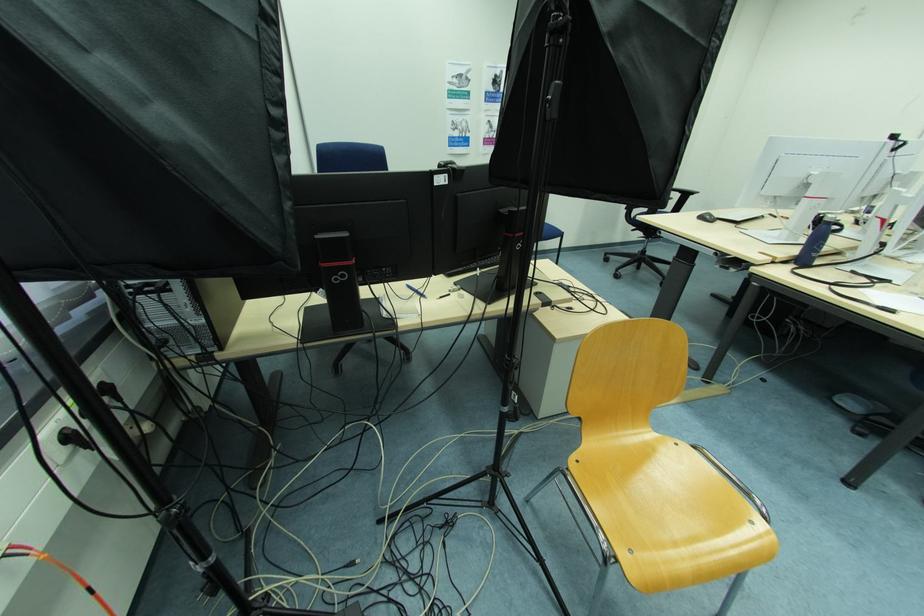
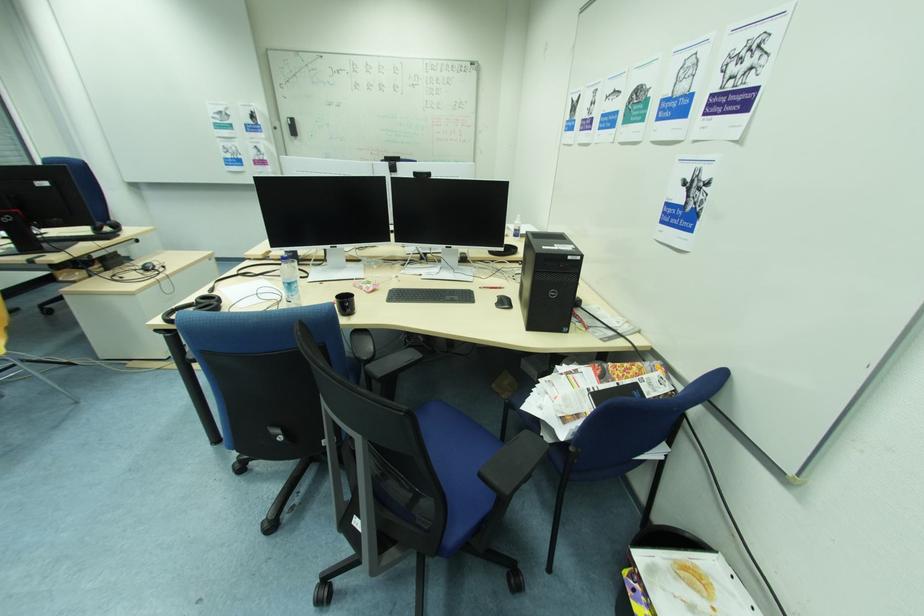
Question: The images are taken continuously from a first-person perspective. In which direction are you moving?

Choices:
 (A) Left
 (B) Right
 (C) Forward
 (D) Backward

Answer: (B)